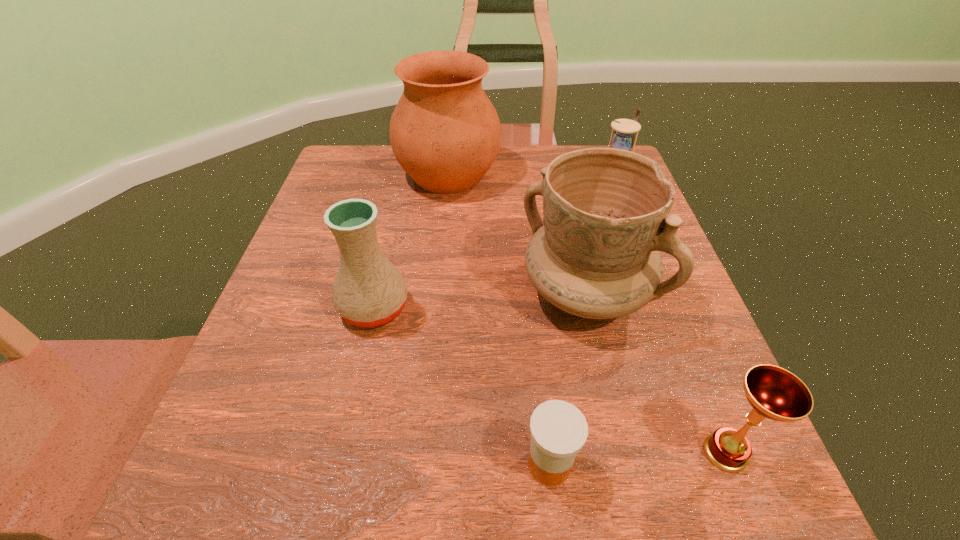
Find the location of `hourglass that is at the right edge`. hourglass that is at the right edge is located at coordinates (623, 138).

Find the location of `chalice present at the right edge`. chalice present at the right edge is located at coordinates (775, 393).

Locate an element on the screen. object that is at the far right corner is located at coordinates [x=623, y=138].

Where is `object that is at the near right corner`? Image resolution: width=960 pixels, height=540 pixels. object that is at the near right corner is located at coordinates (775, 393).

Where is `free spot at the far edge of the desktop`? free spot at the far edge of the desktop is located at coordinates (408, 180).

In the image, there is a desktop. Find the location of `vacant area at the near edge`. vacant area at the near edge is located at coordinates (574, 498).

Image resolution: width=960 pixels, height=540 pixels. In the image, there is a desktop. Identify the location of free space at the left edge. (310, 227).

You are a GUI agent. You are given a task and a screenshot of the screen. Output one action in this format:
    pyautogui.click(x=<x>, y=<y>)
    Task: Click on the free space at the near right corner of the desktop
    The width and height of the screenshot is (960, 540).
    Given the screenshot: What is the action you would take?
    pyautogui.click(x=743, y=502)

This screenshot has height=540, width=960. I want to click on empty space between the chalice and the fourth shortest object, so click(549, 380).

Identify the location of blank region between the hourglass and the chalice. (668, 318).